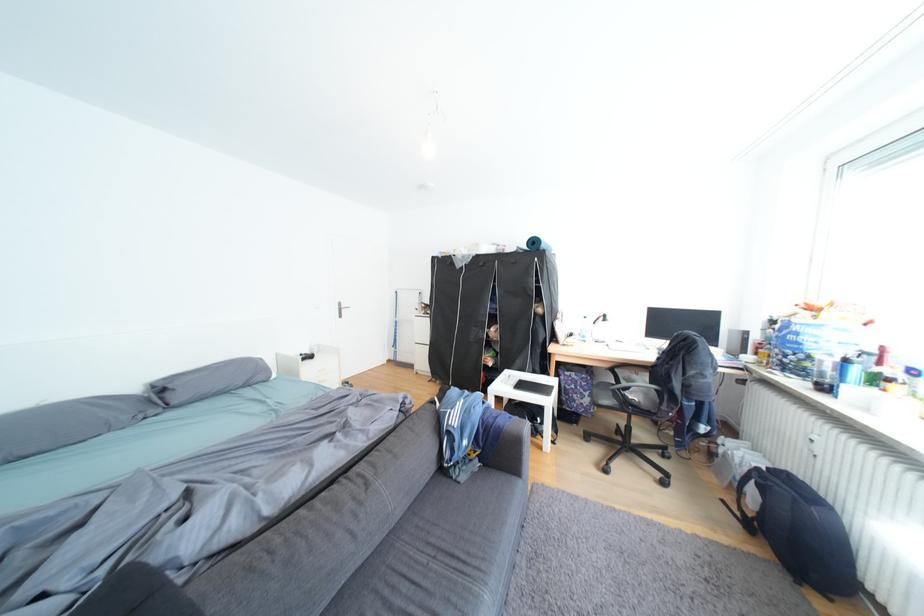
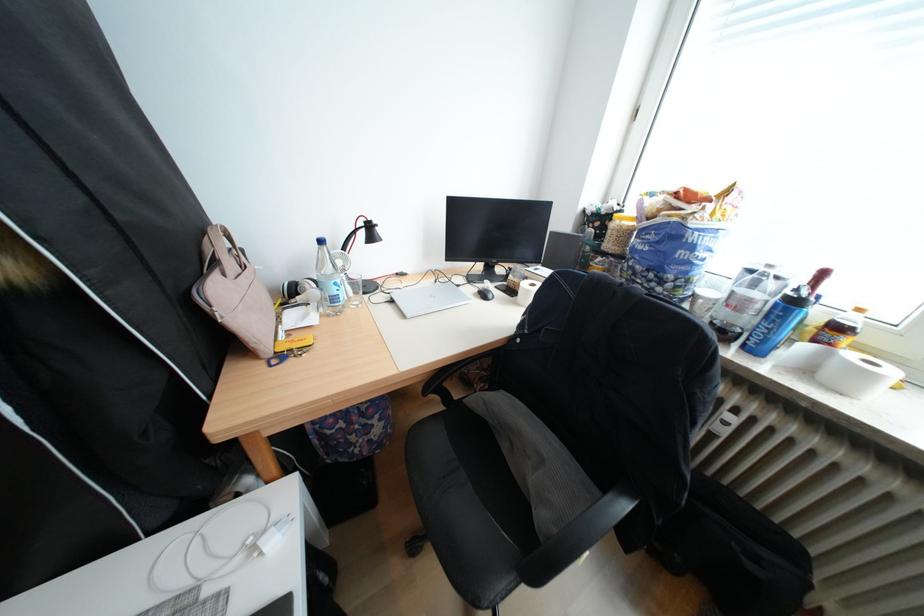
Question: I am providing you with two images of the same scene from different viewpoints. After the viewpoint changes to image2, which objects are now occluded?

Choices:
 (A) black chair armrest
 (B) black suitcase
 (C) clear drinking glass
 (D) none of these

Answer: (D)